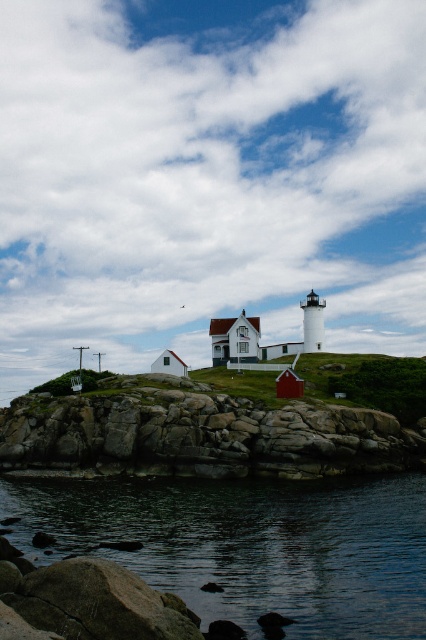
You are a boat captain approaching the island. You see the dark blue water at lower center and the rocky cliff at lower left in your view. Which one is closer to your boat?

The dark blue water at lower center is closer because it is in front of the rocky cliff at lower left.

You are a boat captain planning to dock your vessel at the dark blue water at lower center. Considering the width of the rocky cliff at lower left, will there be enough space for your boat to maneuver safely?

The dark blue water at lower center has a lesser width compared to the rocky cliff at lower left. However, since the water is at the lower center and the cliff is at the lower left, the actual maneuvering space depends on the boat size and the specific width difference. Without exact measurements, it is difficult to determine if there is enough space. Please consult a nautical chart for precise dimensions.

You are a boat captain navigating near the coast. You see the dark blue water at lower center and the rocky cliff at lower left. Which area would you avoid due to potential hazards?

You should avoid the rocky cliff at lower left because it is larger than the dark blue water at lower center, making it a potential hazard for navigation.